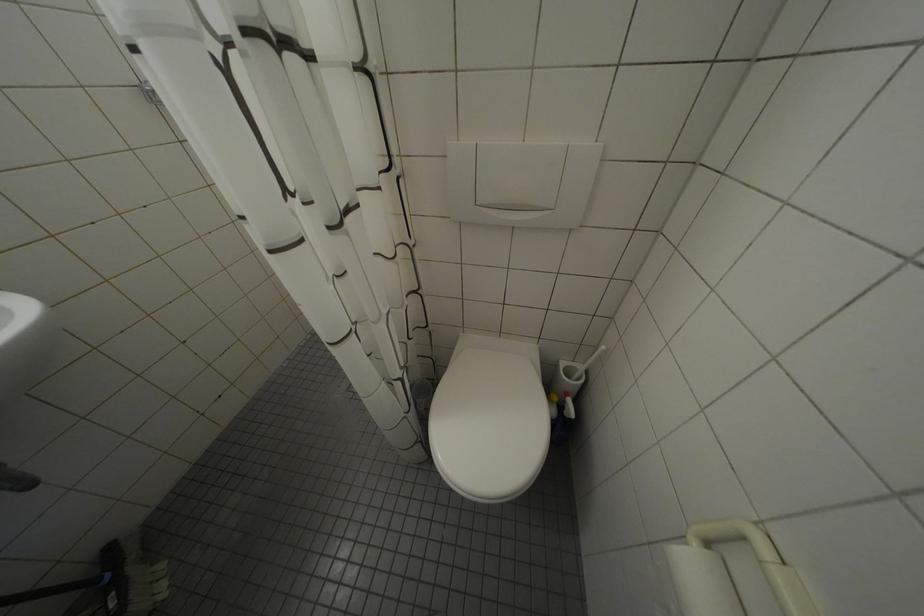
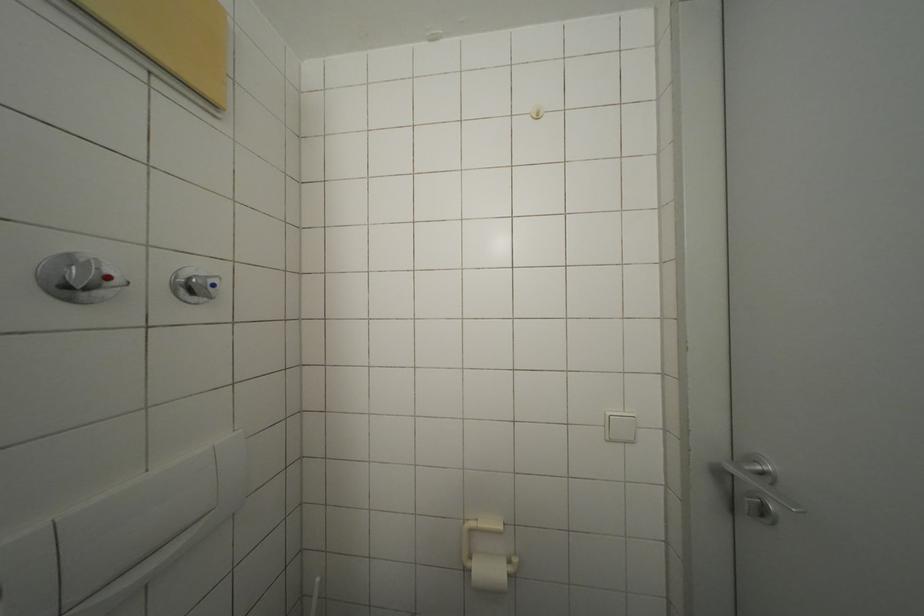
Question: The camera is either moving clockwise (left) or counter-clockwise (right) around the object. The first image is from the beginning of the video and the second image is from the end. Is the camera moving left or right when shooting the video?

Choices:
 (A) Left
 (B) Right

Answer: (A)